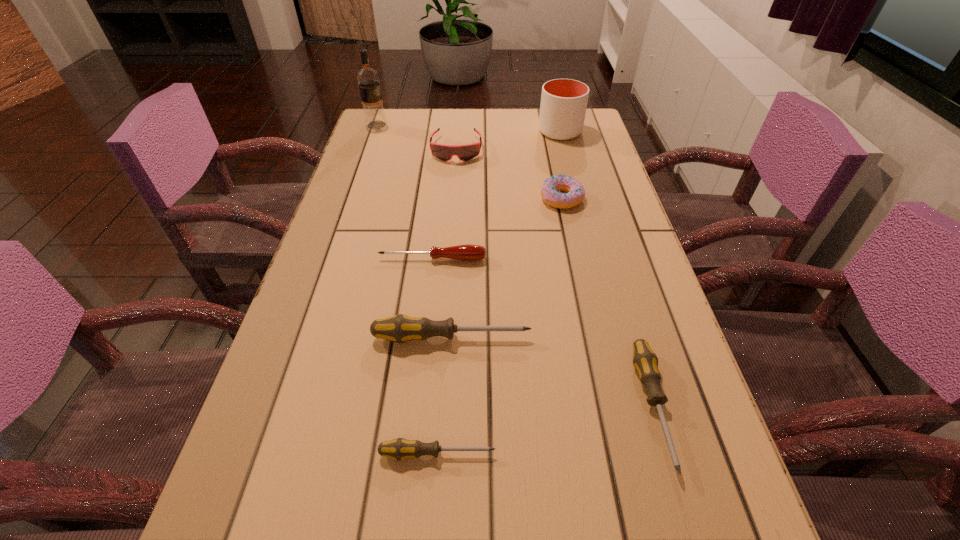
This screenshot has width=960, height=540. In order to click on blank area located at the tip of the smallest gray screwdriver in this screenshot , I will do `click(624, 454)`.

Find the location of a particular element. The image size is (960, 540). vodka located in the far edge section of the desktop is located at coordinates (368, 79).

What are the coordinates of `cup that is at the far edge` in the screenshot? It's located at (563, 106).

I want to click on goggles that is at the far edge, so click(x=443, y=152).

Locate an element on the screen. vodka that is at the left edge is located at coordinates (368, 79).

Image resolution: width=960 pixels, height=540 pixels. I want to click on screwdriver that is at the left edge, so click(x=469, y=252).

What are the coordinates of `cup at the right edge` in the screenshot? It's located at (563, 106).

This screenshot has height=540, width=960. Identify the location of doughnut that is at the right edge. (550, 191).

Image resolution: width=960 pixels, height=540 pixels. Identify the location of screwdriver present at the right edge. (645, 361).

This screenshot has width=960, height=540. I want to click on object that is at the far left corner, so click(x=368, y=79).